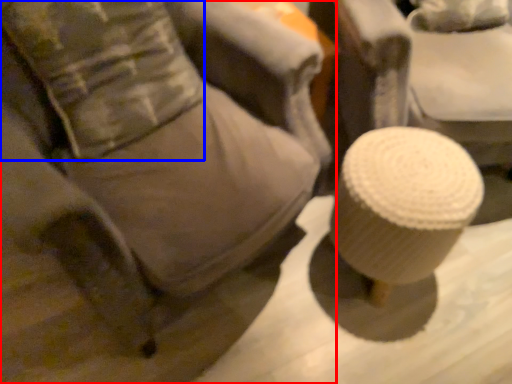
Question: Which of the following is the farthest to the observer, furniture (highlighted by a red box) or pillow (highlighted by a blue box)?

Choices:
 (A) furniture
 (B) pillow

Answer: (B)